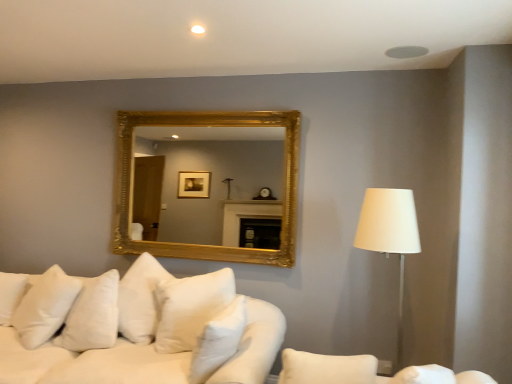
Measure the distance between point (372, 209) and camera.

The depth of point (372, 209) is 7.42 feet.

Based on the photo, measure the distance between point (x=59, y=315) and camera.

Point (x=59, y=315) and camera are 2.68 meters apart from each other.

Describe the element at coordinates (365, 371) in the screenshot. I see `white fabric couch at lower right` at that location.

The height and width of the screenshot is (384, 512). What do you see at coordinates (211, 176) in the screenshot? I see `gold/gilded mirror at upper center` at bounding box center [211, 176].

Where is `white fabric lampshade at right`? The height and width of the screenshot is (384, 512). white fabric lampshade at right is located at coordinates (390, 235).

How many degrees apart are the facing directions of white soft pillow at center, placed as the 1th pillow when sorted from front to back, and white soft cushions at lower left?

102 degrees separate the facing orientations of white soft pillow at center, placed as the 1th pillow when sorted from front to back, and white soft cushions at lower left.

Does white soft pillow at center, the second pillow from the back, appear on the left side of white soft cushions at lower left?

Incorrect, white soft pillow at center, the second pillow from the back, is not on the left side of white soft cushions at lower left.

From a real-world perspective, is white soft pillow at center, placed as the 1th pillow when sorted from front to back, physically located above or below white soft cushions at lower left?

From a real-world perspective, white soft pillow at center, placed as the 1th pillow when sorted from front to back, is physically above white soft cushions at lower left.

Is white fabric couch at lower right turned away from white soft pillow at center, the second pillow from the back?

white fabric couch at lower right does not have its back to white soft pillow at center, the second pillow from the back.

Which object is further away from the camera, white fabric couch at lower right or white soft pillow at center, the second pillow from the back?

white soft pillow at center, the second pillow from the back, is more distant.

Considering the relative sizes of white fabric couch at lower right and white soft pillow at center, the second pillow from the back, in the image provided, is white fabric couch at lower right taller than white soft pillow at center, the second pillow from the back,?

In fact, white fabric couch at lower right may be shorter than white soft pillow at center, the second pillow from the back.

Is point (371, 371) in front of point (397, 247)?

No, it is behind (397, 247).

How many degrees apart are the facing directions of white fabric couch at lower right and white fabric lampshade at right?

They differ by 25.9 degrees in their facing directions.

Would you say white fabric couch at lower right is outside white fabric lampshade at right?

Yes, white fabric couch at lower right is located beyond the bounds of white fabric lampshade at right.

Which of these two, white fabric lampshade at right or white fabric couch at lower right, is wider?

white fabric couch at lower right is wider.

Is point (385, 238) closer or farther from the camera than point (298, 371)?

Point (385, 238).

Looking at this image, considering the relative sizes of white fabric lampshade at right and white fabric couch at lower right in the image provided, is white fabric lampshade at right taller than white fabric couch at lower right?

Correct, white fabric lampshade at right is much taller as white fabric couch at lower right.

Is white fabric lampshade at right oriented away from white fabric couch at lower right?

No, white fabric lampshade at right's orientation is not away from white fabric couch at lower right.

Measure the distance between gold/gilded mirror at upper center and white soft pillow at lower left, the second pillow in the right-to-left sequence.

gold/gilded mirror at upper center and white soft pillow at lower left, the second pillow in the right-to-left sequence, are 4.19 meters apart from each other.

Which is closer to the camera, (217,178) or (32,313)?

Point (217,178) is positioned farther from the camera compared to point (32,313).

Is gold/gilded mirror at upper center facing towards white soft pillow at lower left, which is the 1th pillow from left to right?

No, gold/gilded mirror at upper center is not facing towards white soft pillow at lower left, which is the 1th pillow from left to right.

From the image's perspective, is gold/gilded mirror at upper center above white soft pillow at lower left, acting as the second pillow starting from the front?

Correct, gold/gilded mirror at upper center appears higher than white soft pillow at lower left, acting as the second pillow starting from the front, in the image.

From the image's perspective, which one is positioned lower, white soft pillow at lower left, the second pillow in the right-to-left sequence, or white fabric couch at lower right?

white soft pillow at lower left, the second pillow in the right-to-left sequence.

Is white soft pillow at lower left, acting as the second pillow starting from the front, thinner than white fabric couch at lower right?

Indeed, white soft pillow at lower left, acting as the second pillow starting from the front, has a lesser width compared to white fabric couch at lower right.

Which is less distant, (19, 311) or (337, 356)?

Point (19, 311) is positioned closer to the camera compared to point (337, 356).

From the image's perspective, is white soft cushions at lower left below white fabric lampshade at right?

Yes.

How different are the orientations of white soft cushions at lower left and white fabric lampshade at right in degrees?

91.2 degrees separate the facing orientations of white soft cushions at lower left and white fabric lampshade at right.

Who is taller, white soft cushions at lower left or white fabric lampshade at right?

Standing taller between the two is white fabric lampshade at right.

Which is more to the right, white soft cushions at lower left or white fabric lampshade at right?

From the viewer's perspective, white fabric lampshade at right appears more on the right side.

From a real-world perspective, count 1st pillows upward from the white soft cushions at lower left and point to it. Please provide its 2D coordinates.

[(218, 341)]

This screenshot has width=512, height=384. Identify the location of couch on the right of the white soft pillow at center, placed as the 1th pillow when sorted from front to back. (365, 371).

Based on their spatial positions, is gold/gilded mirror at upper center or white soft pillow at lower left, the 1th pillow from the back, closer to white soft cushions at lower left?

Among the two, white soft pillow at lower left, the 1th pillow from the back, is located nearer to white soft cushions at lower left.

Looking at this image, which object lies nearer to the anchor point white soft cushions at lower left, white soft pillow at lower left, which is the 1th pillow from left to right, or white soft pillow at center, which ranks as the 2th pillow in left-to-right order?

white soft pillow at lower left, which is the 1th pillow from left to right, is positioned closer to the anchor white soft cushions at lower left.

From the image, which object appears to be nearer to white fabric lampshade at right, white soft pillow at lower left, the second pillow in the right-to-left sequence, or gold/gilded mirror at upper center?

The object closer to white fabric lampshade at right is white soft pillow at lower left, the second pillow in the right-to-left sequence.

Which object lies further to the anchor point white soft pillow at center, the 1th pillow from the right, gold/gilded mirror at upper center or white fabric lampshade at right?

Among the two, gold/gilded mirror at upper center is located further to white soft pillow at center, the 1th pillow from the right.

Looking at the image, which one is located closer to white fabric couch at lower right, white soft pillow at center, the second pillow from the back, or white fabric lampshade at right?

Based on the image, white soft pillow at center, the second pillow from the back, appears to be nearer to white fabric couch at lower right.

Which object lies further to the anchor point white soft pillow at lower left, the second pillow in the right-to-left sequence, white soft cushions at lower left or white fabric lampshade at right?

The object further to white soft pillow at lower left, the second pillow in the right-to-left sequence, is white fabric lampshade at right.

Which object lies nearer to the anchor point white soft pillow at lower left, the 1th pillow from the back, gold/gilded mirror at upper center or white fabric couch at lower right?

Among the two, white fabric couch at lower right is located nearer to white soft pillow at lower left, the 1th pillow from the back.

Looking at the image, which one is located closer to white soft cushions at lower left, gold/gilded mirror at upper center or white fabric lampshade at right?

white fabric lampshade at right lies closer to white soft cushions at lower left than the other object.

Where is `studio couch located between white fabric couch at lower right and gold/gilded mirror at upper center in the depth direction`? This screenshot has height=384, width=512. studio couch located between white fabric couch at lower right and gold/gilded mirror at upper center in the depth direction is located at coordinates (135, 328).

Locate an element on the screen. pillow located between white soft cushions at lower left and white fabric lampshade at right in the left-right direction is located at coordinates (218, 341).

This screenshot has height=384, width=512. Find the location of `pillow located between white soft pillow at lower left, the second pillow in the right-to-left sequence, and white fabric lampshade at right in the left-right direction`. pillow located between white soft pillow at lower left, the second pillow in the right-to-left sequence, and white fabric lampshade at right in the left-right direction is located at coordinates (218, 341).

You are a GUI agent. You are given a task and a screenshot of the screen. Output one action in this format:
    pyautogui.click(x=<x>, y=<y>)
    Task: Click on the couch between white soft cushions at lower left and white fabric lampshade at right
    
    Given the screenshot: What is the action you would take?
    pyautogui.click(x=365, y=371)